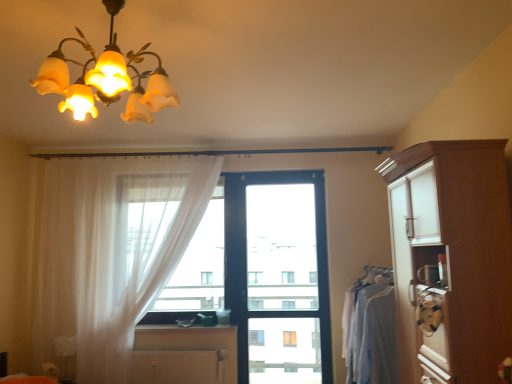
Question: From the image's perspective, is smooth wooden counter top at center beneath black plastic window at center?

Choices:
 (A) no
 (B) yes

Answer: (B)

Question: From the image's perspective, is smooth wooden counter top at center above black plastic window at center?

Choices:
 (A) no
 (B) yes

Answer: (A)

Question: Is smooth wooden counter top at center to the left of black plastic window at center from the viewer's perspective?

Choices:
 (A) no
 (B) yes

Answer: (B)

Question: Is smooth wooden counter top at center directly adjacent to black plastic window at center?

Choices:
 (A) no
 (B) yes

Answer: (A)

Question: Does smooth wooden counter top at center have a greater height compared to black plastic window at center?

Choices:
 (A) no
 (B) yes

Answer: (A)

Question: In terms of size, does white matte cabinet at lower center, the first cabinetry positioned from the back, appear bigger or smaller than smooth wooden counter top at center?

Choices:
 (A) small
 (B) big

Answer: (B)

Question: From a real-world perspective, relative to smooth wooden counter top at center, is white matte cabinet at lower center, the second cabinetry in the top-to-bottom sequence, vertically above or below?

Choices:
 (A) above
 (B) below

Answer: (B)

Question: Is white matte cabinet at lower center, which ranks as the 2th cabinetry in front-to-back order, in front of or behind smooth wooden counter top at center in the image?

Choices:
 (A) front
 (B) behind

Answer: (A)

Question: Considering the relative positions of white matte cabinet at lower center, acting as the second cabinetry starting from the right, and smooth wooden counter top at center in the image provided, is white matte cabinet at lower center, acting as the second cabinetry starting from the right, to the left or to the right of smooth wooden counter top at center?

Choices:
 (A) left
 (B) right

Answer: (A)

Question: Is brown wood cabinet at right, the second cabinetry in the back-to-front sequence, inside or outside of light gray fabric at right?

Choices:
 (A) outside
 (B) inside

Answer: (A)

Question: From a real-world perspective, is brown wood cabinet at right, which ranks as the 2th cabinetry in bottom-to-top order, physically located above or below light gray fabric at right?

Choices:
 (A) below
 (B) above

Answer: (B)

Question: In terms of size, does brown wood cabinet at right, which appears as the 2th cabinetry when viewed from the left, appear bigger or smaller than light gray fabric at right?

Choices:
 (A) big
 (B) small

Answer: (A)

Question: In terms of height, does brown wood cabinet at right, the 1th cabinetry when ordered from top to bottom, look taller or shorter compared to light gray fabric at right?

Choices:
 (A) tall
 (B) short

Answer: (A)

Question: Is point (174, 291) positioned closer to the camera than point (464, 142)?

Choices:
 (A) closer
 (B) farther

Answer: (B)

Question: Considering the positions of translucent fabric at center and brown wood cabinet at right, placed as the first cabinetry when sorted from front to back, in the image, is translucent fabric at center bigger or smaller than brown wood cabinet at right, placed as the first cabinetry when sorted from front to back,?

Choices:
 (A) small
 (B) big

Answer: (A)